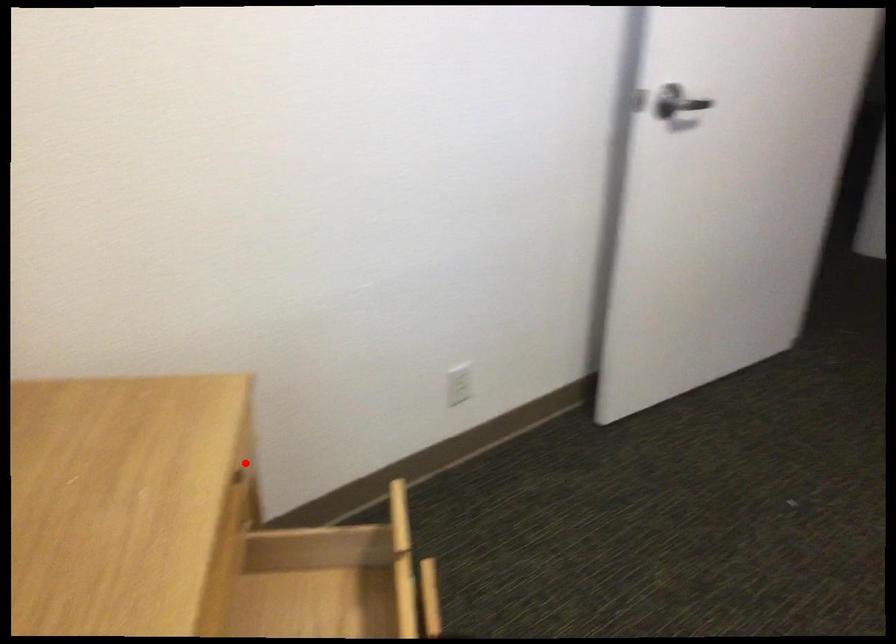
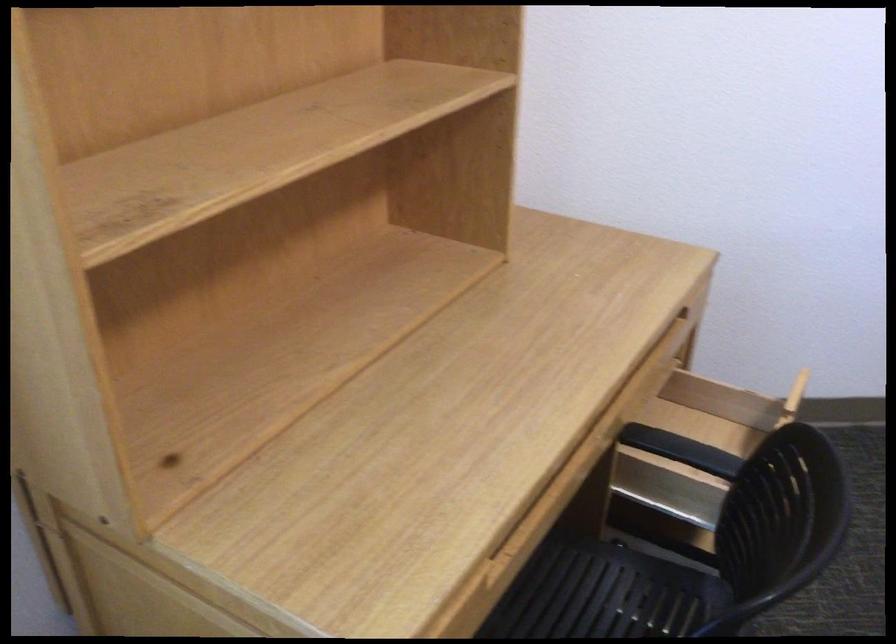
Question: A red point is marked in image1. In image2, is the corresponding 3D point closer to the camera or farther? Reply with the corresponding letter.

Choices:
 (A) The corresponding 3D point is closer.
 (B) The corresponding 3D point is farther.

Answer: (B)